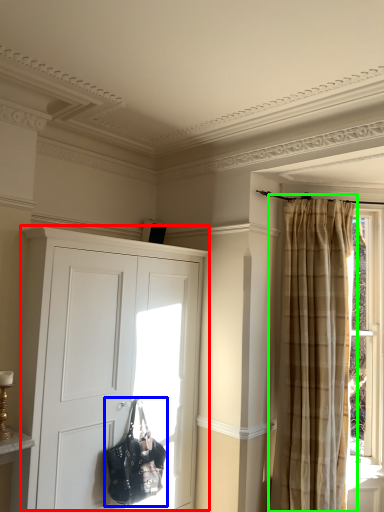
Question: Which is nearer to the cupboard (highlighted by a red box)? handbag (highlighted by a blue box) or curtain (highlighted by a green box).

Choices:
 (A) handbag
 (B) curtain

Answer: (A)